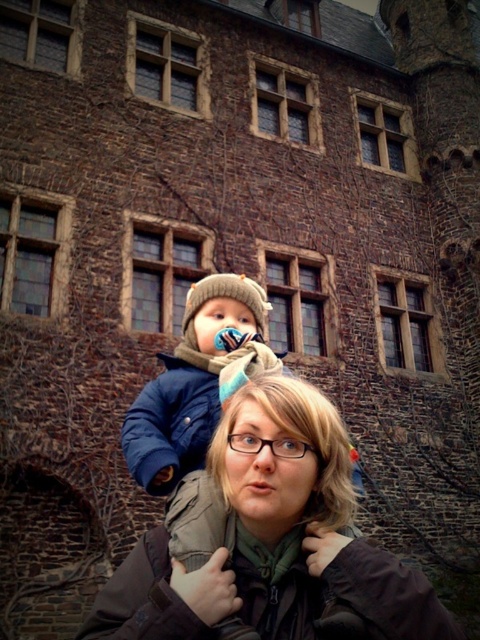
You are standing in front of the historic stone building and see two points marked in the image. The first point is labeled as point (280,412) and the second as point (199,385). Which of these two points is closer to you?

Point (280,412) is in front of point (199,385), so it is closer to you.

You are a photographer standing at the center of the scene. You want to take a photo of both the green fabric jacket at center and the blue fleece jacket at center in the same frame. Can you position yourself so that both jackets are within the camera lens range? The camera has a maximum focal length that allows capturing objects up to 5 meters apart.

Yes, the distance between the green fabric jacket at center and the blue fleece jacket at center is 4.60 meters, which is within the camera lens range of 5 meters. Position yourself centrally between them to capture both in the same frame.